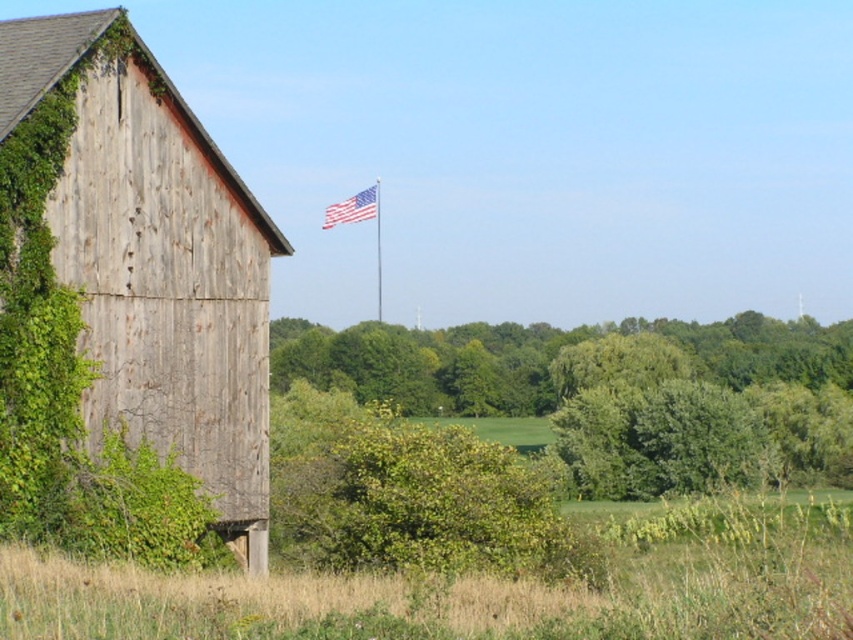
Question: Which is nearer to the american flag at upper center?

Choices:
 (A) weathered wood barn at left
 (B) green leafy tree at center

Answer: (B)

Question: Which object appears closest to the camera in this image?

Choices:
 (A) american flag at upper center
 (B) green leafy tree at center

Answer: (B)

Question: Which is nearer to the weathered wood barn at left?

Choices:
 (A) green leafy tree at center
 (B) american flag at upper center

Answer: (A)

Question: Is green leafy tree at center above american flag at upper center?

Choices:
 (A) yes
 (B) no

Answer: (B)

Question: Can you confirm if weathered wood barn at left is positioned above american flag at upper center?

Choices:
 (A) yes
 (B) no

Answer: (B)

Question: Does weathered wood barn at left appear over green leafy tree at center?

Choices:
 (A) yes
 (B) no

Answer: (A)